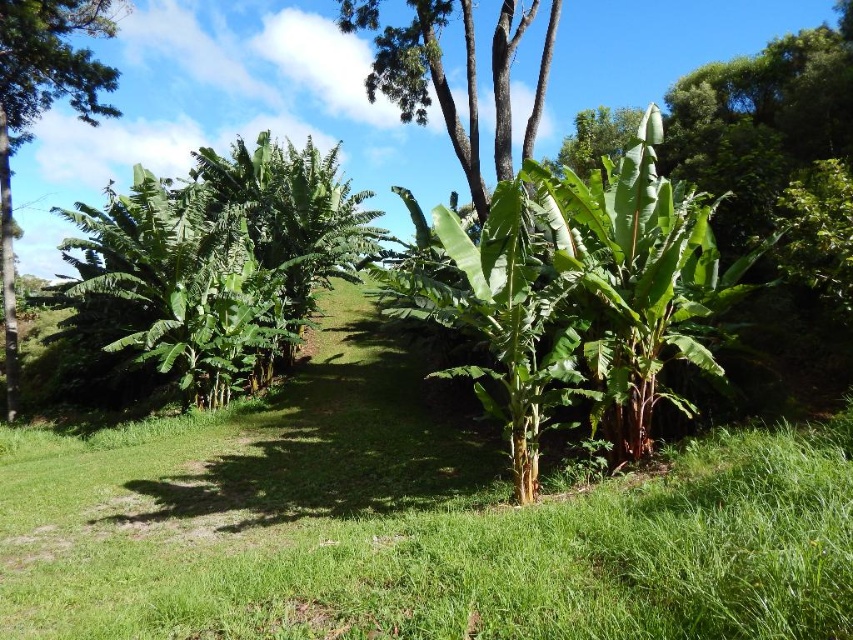
Question: Can you confirm if green leafy banana tree at center is positioned to the right of green leafy banana tree at left?

Choices:
 (A) yes
 (B) no

Answer: (A)

Question: Which of the following is the farthest from the observer?

Choices:
 (A) green leafy tree at center
 (B) green leafy tree at left

Answer: (B)

Question: Does green leafy banana tree at center have a larger size compared to green leafy banana tree at left?

Choices:
 (A) yes
 (B) no

Answer: (B)

Question: Which point is closer to the camera?

Choices:
 (A) (258, 163)
 (B) (341, 3)
 (C) (79, 20)

Answer: (B)

Question: Which object is closer to the camera taking this photo?

Choices:
 (A) green leafy tree at center
 (B) green leafy banana tree at center

Answer: (B)

Question: Can you confirm if green leafy tree at center is positioned to the right of green leafy tree at left?

Choices:
 (A) no
 (B) yes

Answer: (B)